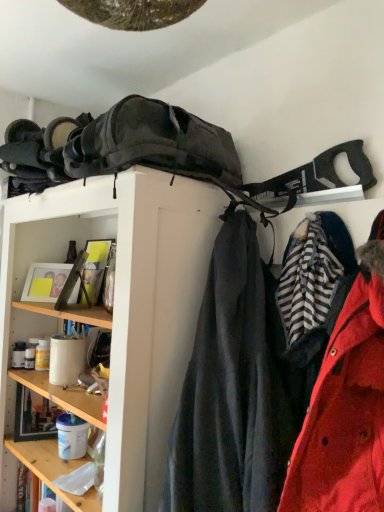
Question: From a real-world perspective, is red matte coat at right positioned over matte black backpack at upper center based on gravity?

Choices:
 (A) yes
 (B) no

Answer: (A)

Question: From the image's perspective, is red matte coat at right beneath matte black backpack at upper center?

Choices:
 (A) no
 (B) yes

Answer: (A)

Question: From the image's perspective, is red matte coat at right above matte black backpack at upper center?

Choices:
 (A) no
 (B) yes

Answer: (B)

Question: Is red matte coat at right looking in the opposite direction of matte black backpack at upper center?

Choices:
 (A) no
 (B) yes

Answer: (A)

Question: Does red matte coat at right have a greater width compared to matte black backpack at upper center?

Choices:
 (A) yes
 (B) no

Answer: (B)

Question: Considering the relative sizes of red matte coat at right and matte black backpack at upper center in the image provided, is red matte coat at right smaller than matte black backpack at upper center?

Choices:
 (A) yes
 (B) no

Answer: (A)

Question: Is red matte coat at right at the back of matte black backpack at upper center?

Choices:
 (A) yes
 (B) no

Answer: (A)

Question: Can you confirm if matte black backpack at upper center is smaller than red matte coat at right?

Choices:
 (A) yes
 (B) no

Answer: (B)

Question: Does matte black backpack at upper center come in front of red matte coat at right?

Choices:
 (A) yes
 (B) no

Answer: (A)

Question: Is matte black backpack at upper center oriented towards red matte coat at right?

Choices:
 (A) yes
 (B) no

Answer: (A)

Question: Is matte black backpack at upper center taller than red matte coat at right?

Choices:
 (A) no
 (B) yes

Answer: (B)

Question: From a real-world perspective, is matte black backpack at upper center beneath red matte coat at right?

Choices:
 (A) no
 (B) yes

Answer: (B)

Question: In the image, is matte black backpack at upper center positioned in front of or behind red matte coat at right?

Choices:
 (A) front
 (B) behind

Answer: (A)